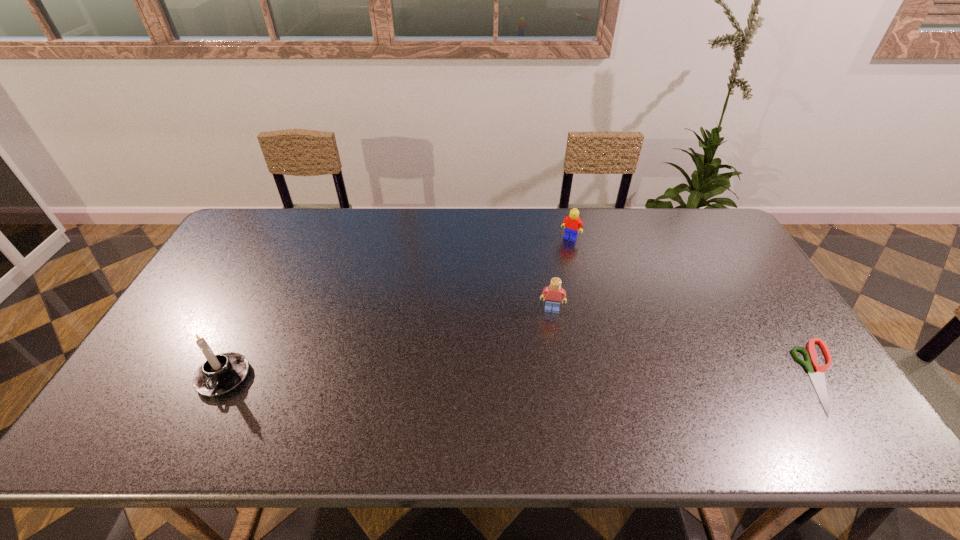
Identify the location of vacant area that lies between the rightmost object and the tallest object. This screenshot has height=540, width=960. (524, 376).

Locate an element on the screen. The image size is (960, 540). free space between the right Lego and the second object from left to right is located at coordinates (561, 273).

Locate an element on the screen. free spot between the farthest object and the shortest object is located at coordinates (697, 307).

Locate an element on the screen. The image size is (960, 540). free space between the shortest object and the tallest object is located at coordinates (524, 376).

Find the location of a particular element. The height and width of the screenshot is (540, 960). empty location between the shortest object and the farthest object is located at coordinates (697, 307).

The width and height of the screenshot is (960, 540). In order to click on vacant area that lies between the farther Lego and the shortest object in this screenshot , I will do `click(697, 307)`.

This screenshot has height=540, width=960. What are the coordinates of `empty space that is in between the farther Lego and the shortest object` in the screenshot? It's located at (697, 307).

Select which object appears as the third closest to the leftmost object. Please provide its 2D coordinates. Your answer should be formatted as a tuple, i.e. [(x, y)], where the tuple contains the x and y coordinates of a point satisfying the conditions above.

[(818, 379)]

Locate an element on the screen. the closest object relative to the candle holder is located at coordinates (554, 293).

Identify the location of free space that satisfies the following two spatial constraints: 1. on the front side of the left Lego; 2. on the right side of the shortest object. (563, 376).